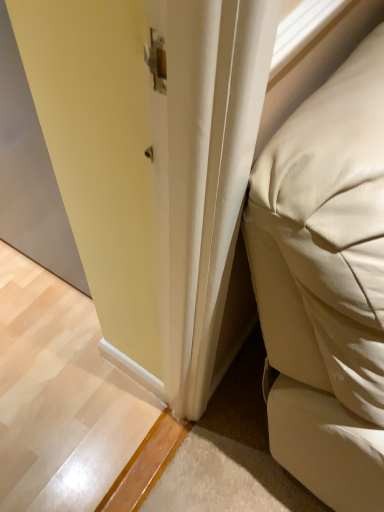
Question: In terms of width, does beige leather bed at right look wider or thinner when compared to matte gray screen door at left?

Choices:
 (A) thin
 (B) wide

Answer: (B)

Question: Is beige leather bed at right in front of or behind matte gray screen door at left in the image?

Choices:
 (A) front
 (B) behind

Answer: (A)

Question: Is point (274, 222) positioned closer to the camera than point (34, 187)?

Choices:
 (A) farther
 (B) closer

Answer: (B)

Question: Would you say matte gray screen door at left is inside or outside beige leather bed at right?

Choices:
 (A) inside
 (B) outside

Answer: (B)

Question: Is matte gray screen door at left in front of or behind beige leather bed at right in the image?

Choices:
 (A) front
 (B) behind

Answer: (B)

Question: In terms of width, does matte gray screen door at left look wider or thinner when compared to beige leather bed at right?

Choices:
 (A) thin
 (B) wide

Answer: (A)

Question: From the image's perspective, relative to beige leather bed at right, is matte gray screen door at left above or below?

Choices:
 (A) below
 (B) above

Answer: (B)